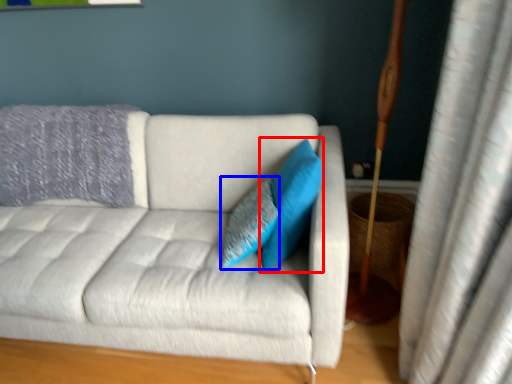
Question: Among these objects, which one is farthest to the camera, pillow (highlighted by a red box) or pillow (highlighted by a blue box)?

Choices:
 (A) pillow
 (B) pillow

Answer: (B)